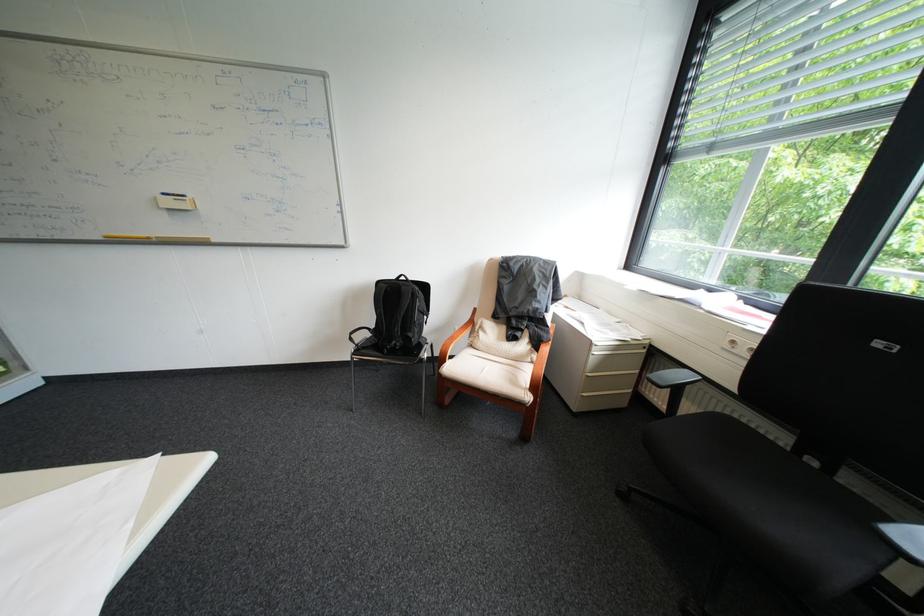
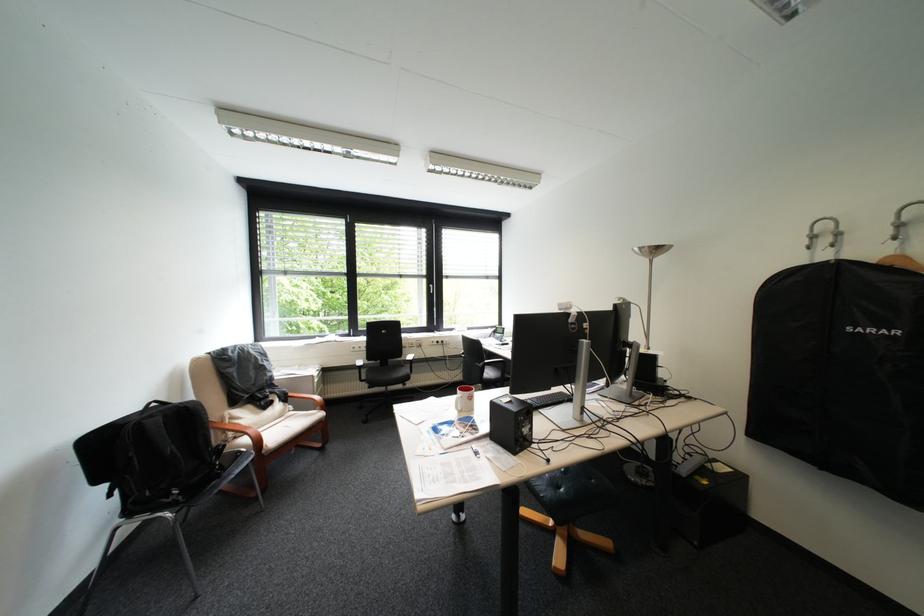
The point at (541, 310) is marked in the first image. Where is the corresponding point in the second image?

(280, 381)